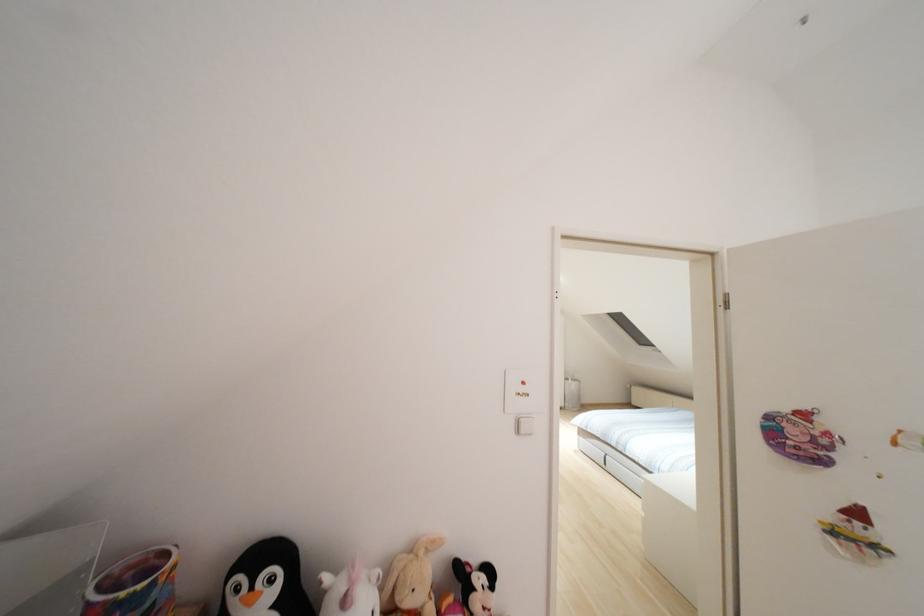
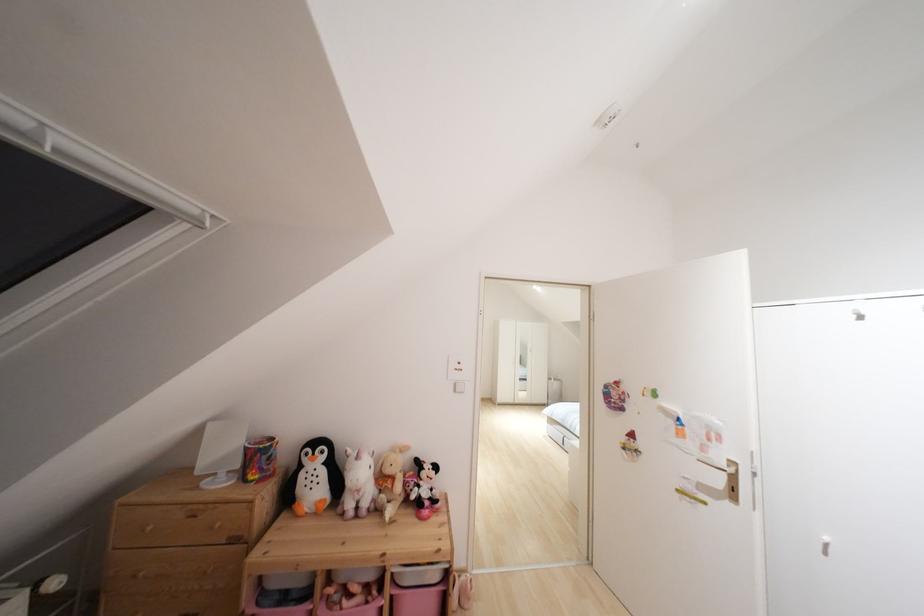
Find the pixel in the second image that matches [517,431] in the first image.

(455, 390)